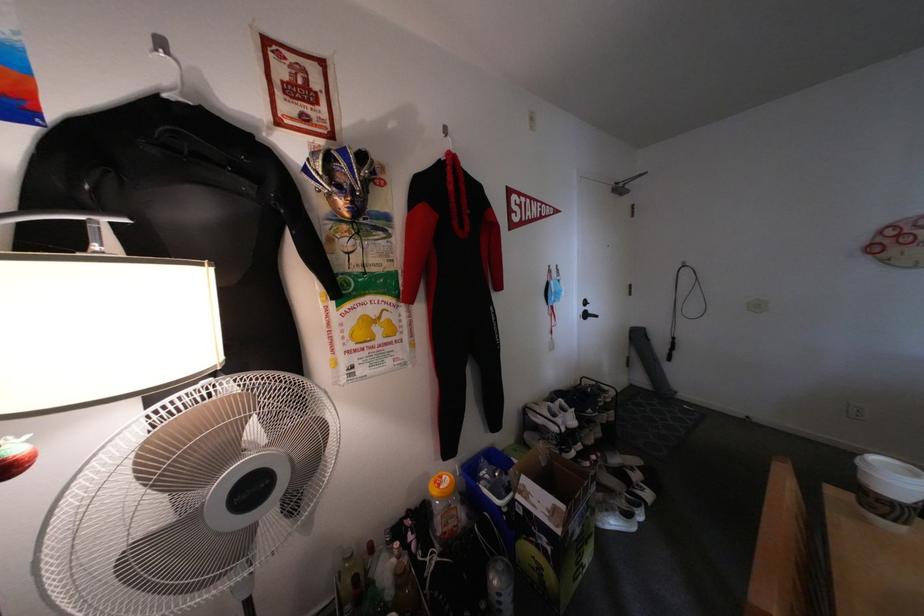
This screenshot has height=616, width=924. Find the location of `black door handle`. black door handle is located at coordinates (590, 314).